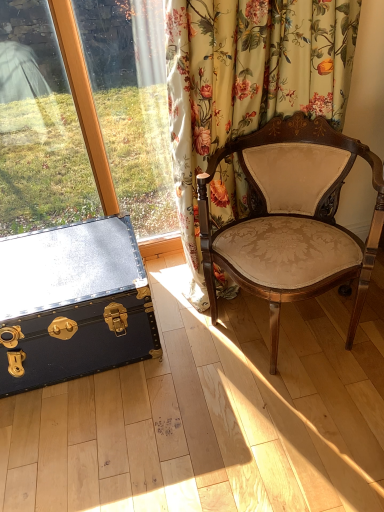
Where is `vacant region above black leather trunk at lower left (from a real-world perspective)`? The width and height of the screenshot is (384, 512). vacant region above black leather trunk at lower left (from a real-world perspective) is located at coordinates [62, 263].